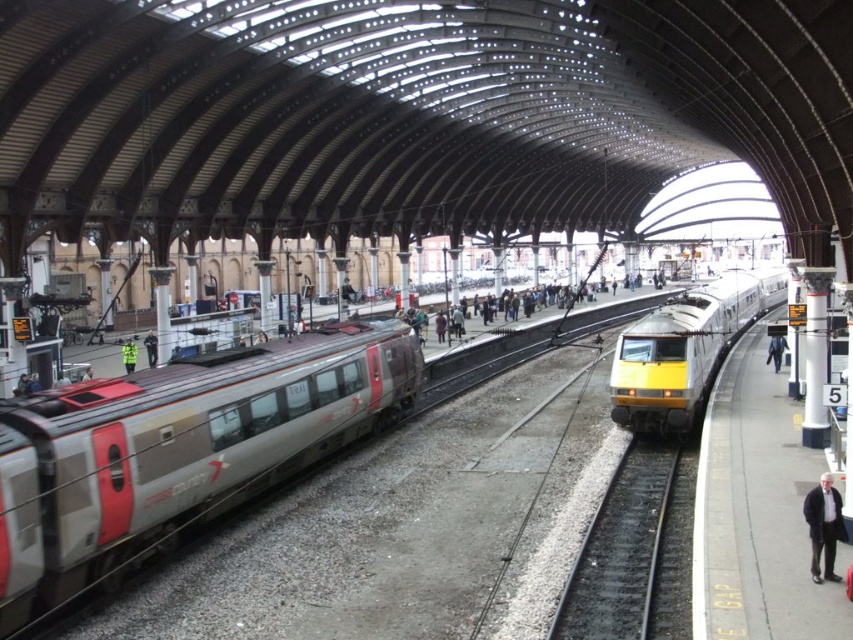
Question: Which of the following is the closest to the observer?

Choices:
 (A) (831, 486)
 (B) (590, 545)
 (C) (727, 284)
 (D) (325, 352)

Answer: (A)

Question: Which object appears farthest from the camera in this image?

Choices:
 (A) high visibility jacket at center
 (B) yellow reflective vest at center
 (C) black asphalt train track at center
 (D) dark gray jacket at lower right

Answer: (A)

Question: In this image, where is yellow metallic train at center located relative to high visibility jacket at center?

Choices:
 (A) left
 (B) right

Answer: (B)

Question: Does silver/grey metallic train at left appear on the right side of black asphalt train track at center?

Choices:
 (A) no
 (B) yes

Answer: (A)

Question: Does black asphalt train track at center have a larger size compared to dark gray jacket at lower right?

Choices:
 (A) yes
 (B) no

Answer: (A)

Question: Which of these objects is positioned farthest from the dark gray jacket at lower right?

Choices:
 (A) black asphalt train track at center
 (B) high visibility jacket at center
 (C) yellow reflective vest at center
 (D) silver/grey metallic train at left

Answer: (B)